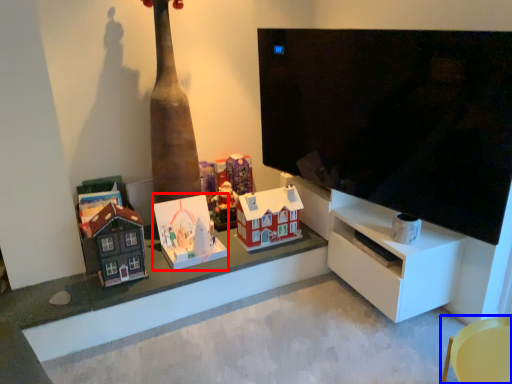
Question: Which of the following is the farthest to the observer, toy (highlighted by a red box) or furniture (highlighted by a blue box)?

Choices:
 (A) toy
 (B) furniture

Answer: (A)